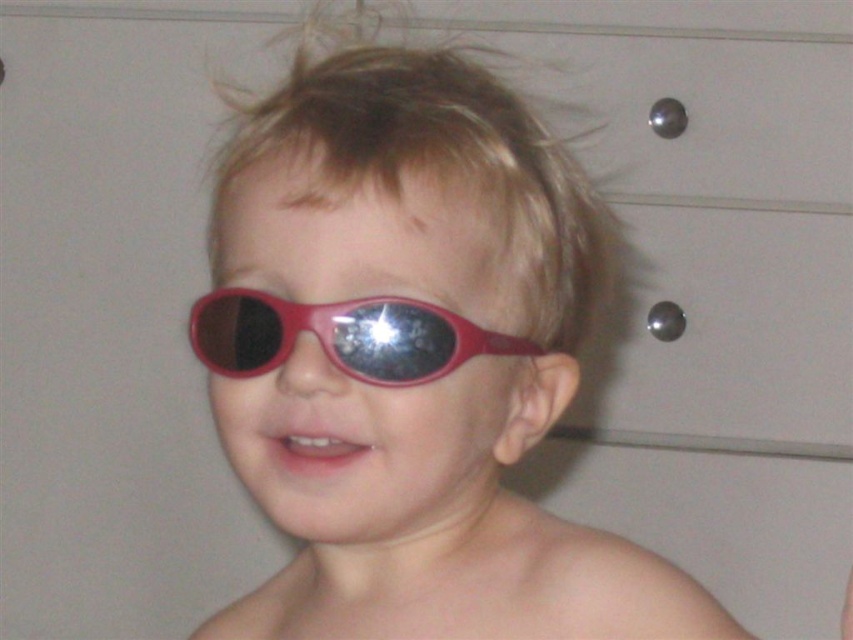
You are a photographer setting up a shoot for a child wearing glasses. You need to ensure that the matte plastic sunglasses at center and the shiny plastic goggles at center are positioned correctly. According to the image, which object is placed lower on the child?

The matte plastic sunglasses at center is located below shiny plastic goggles at center, so the sunglasses are placed lower on the child.

The child is wearing two items on their head. The matte plastic sunglasses at center and the shiny plastic goggles at center. Which one has a wider frame?

The matte plastic sunglasses at center has a wider frame than the shiny plastic goggles at center.